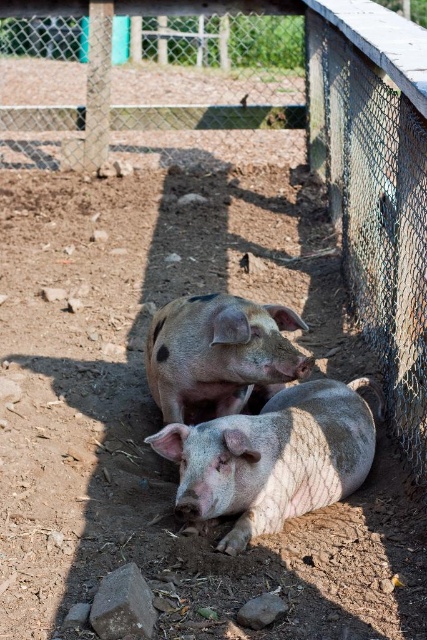
You are a photographer trying to capture a photo of the pink matte pig at center without including the metal mesh fence at upper center in the frame. Based on their heights, is this possible?

The metal mesh fence at upper center is taller than the pink matte pig at center, so it is possible to position the camera lower to exclude the fence from the frame while still capturing the pig.

You are a farmer checking the pigs in the enclosure. You notice both the speckled pink pig at center and the pink matte pig at center. Which one would cast a longer shadow given their sizes?

The speckled pink pig at center has a larger size compared to the pink matte pig at center, so it would cast a longer shadow.

You are a farmer who wants to ensure the pigs have enough space to move freely. Given that the speckled pink pig at center needs at least 10 feet of space to move around, can the metal mesh fence at upper center be positioned closer to the pig without violating this requirement?

The distance between the metal mesh fence at upper center and the speckled pink pig at center is 13.87 feet, which is more than the required 10 feet. Therefore, the farmer can move the metal mesh fence at upper center closer to the speckled pink pig at center as long as the distance remains at least 10 feet.